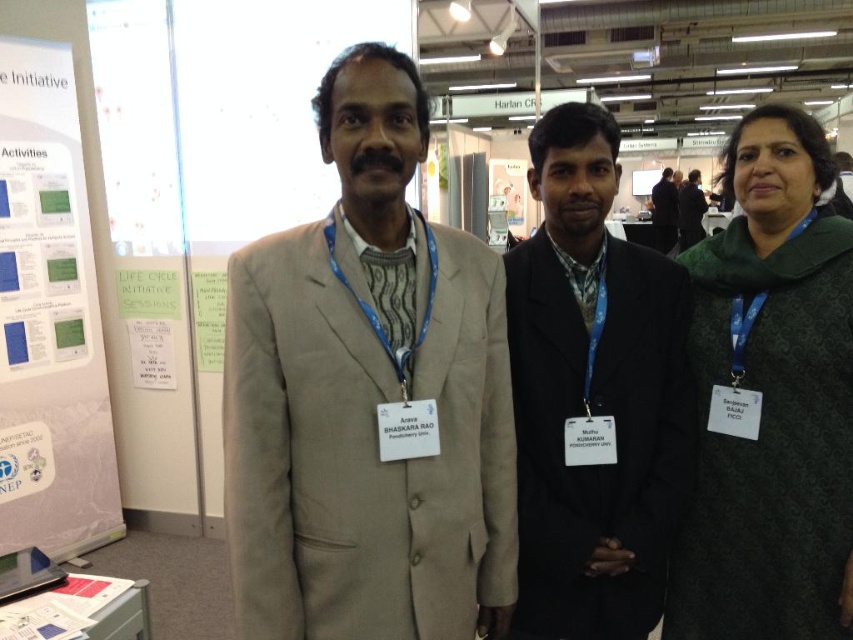
Which is behind, point (345, 72) or point (657, 205)?

The point (657, 205) is behind.

Does beige woolen suit at center appear on the right side of dark gray suit at center?

In fact, beige woolen suit at center is to the left of dark gray suit at center.

Is point (238, 612) farther from camera compared to point (654, 209)?

No, (238, 612) is closer to viewer.

Identify the location of beige woolen suit at center. (368, 397).

Between black matte suit at center and white paper at left, which one appears on the right side from the viewer's perspective?

black matte suit at center is more to the right.

Is point (654, 508) positioned after point (45, 129)?

No, it is in front of (45, 129).

At what (x,y) coordinates should I click in order to perform the action: click on black matte suit at center. Please return your answer as a coordinate pair (x, y). Looking at the image, I should click on (593, 394).

Is beige woolen suit at center positioned at the back of white paper at left?

No, it is not.

Who is more forward, (325, 323) or (77, 506)?

Point (325, 323) is more forward.

Where is `beige woolen suit at center`? This screenshot has width=853, height=640. beige woolen suit at center is located at coordinates (368, 397).